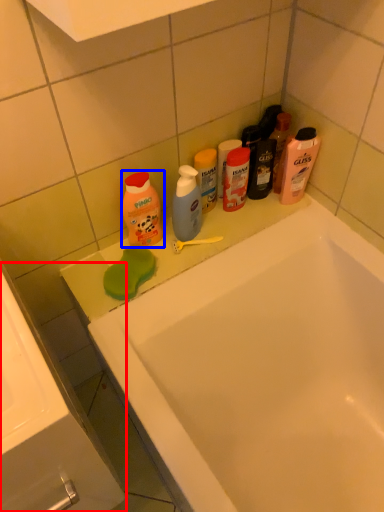
Question: Among these objects, which one is nearest to the camera, sink (highlighted by a red box) or cleaning product (highlighted by a blue box)?

Choices:
 (A) sink
 (B) cleaning product

Answer: (A)